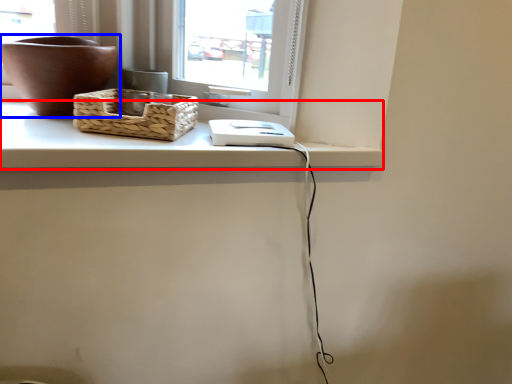
Question: Which object appears closest to the camera in this image, counter top (highlighted by a red box) or flowerpot (highlighted by a blue box)?

Choices:
 (A) counter top
 (B) flowerpot

Answer: (A)